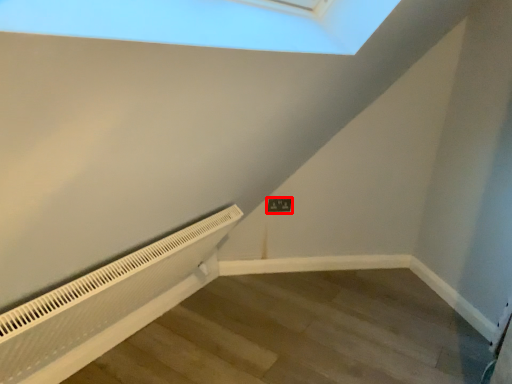
Question: From the image's perspective, considering the relative positions of electric outlet (annotated by the red box) and air conditioner in the image provided, where is electric outlet (annotated by the red box) located with respect to the staircase?

Choices:
 (A) below
 (B) above

Answer: (B)